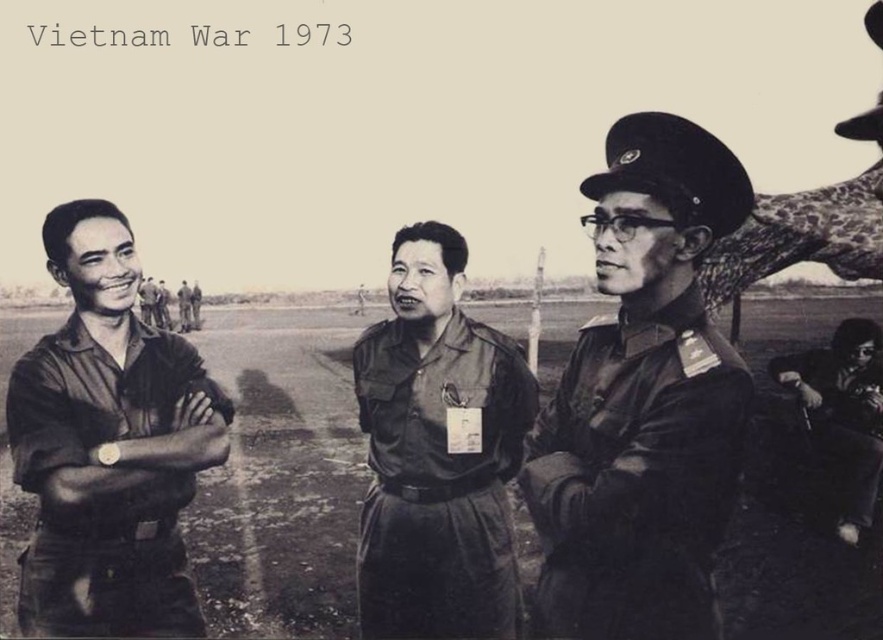
Is matte dark green uniform at center thinner than matte khaki shirt at left?

No.

Between point (479, 593) and point (119, 461), which one is positioned behind?

Point (479, 593)

Who is more distant from viewer, (447,464) or (161,515)?

The point (447,464) is more distant.

What are the coordinates of `matte dark green uniform at center` in the screenshot? It's located at (439, 480).

Is the position of dark olive-green fabric military uniform at center more distant than that of matte khaki uniform at center?

No, it is not.

Is point (708, 602) in front of point (177, 301)?

That is True.

Where is `dark olive-green fabric military uniform at center`? dark olive-green fabric military uniform at center is located at coordinates (636, 476).

Is dark green fabric uniform at lower right closer to the viewer compared to matte khaki uniform at center?

Yes, it is in front of matte khaki uniform at center.

Who is more distant from viewer, (828, 433) or (187, 285)?

The point (187, 285) is behind.

Where is `dark green fabric uniform at lower right`? dark green fabric uniform at lower right is located at coordinates pos(842,416).